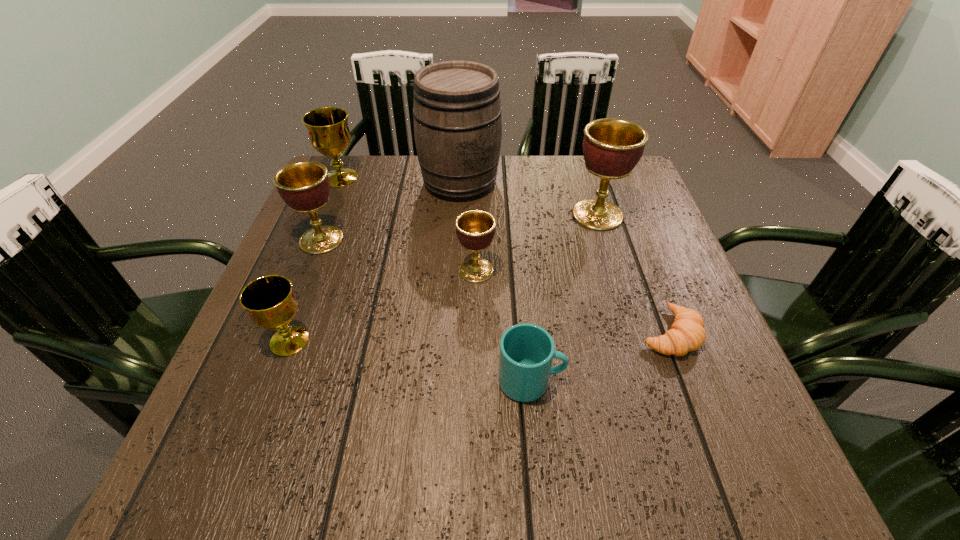
The width and height of the screenshot is (960, 540). What are the coordinates of `wine bucket` in the screenshot? It's located at (457, 112).

Locate an element on the screen. the biggest golden chalice is located at coordinates (612, 147).

Where is `the rightmost golden chalice`? The height and width of the screenshot is (540, 960). the rightmost golden chalice is located at coordinates (612, 147).

The width and height of the screenshot is (960, 540). What are the coordinates of `the farthest chalice` in the screenshot? It's located at (329, 134).

Find the location of a particular element. The width and height of the screenshot is (960, 540). the bigger gold chalice is located at coordinates (329, 134).

Identify the location of the leftmost golden chalice. This screenshot has width=960, height=540. (304, 186).

Identify the location of the smaller gold chalice. The height and width of the screenshot is (540, 960). (269, 300).

Where is `the nearer gold chalice`? Image resolution: width=960 pixels, height=540 pixels. the nearer gold chalice is located at coordinates (269, 300).

This screenshot has width=960, height=540. I want to click on the second chalice from right to left, so click(475, 229).

Locate an element on the screen. the fourth nearest object is located at coordinates (475, 229).